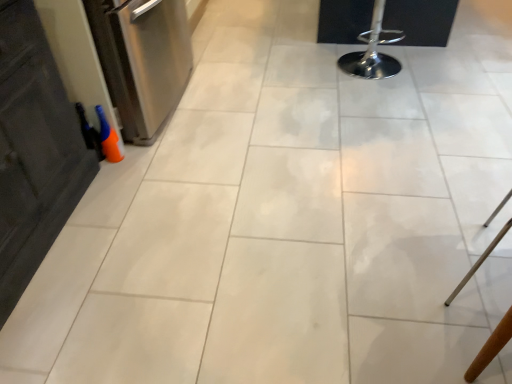
Question: From the image's perspective, would you say polished chrome bar stool at upper right is shown under wooden chair at lower right?

Choices:
 (A) yes
 (B) no

Answer: (B)

Question: Is polished chrome bar stool at upper right not inside wooden chair at lower right?

Choices:
 (A) yes
 (B) no

Answer: (A)

Question: Considering the relative sizes of polished chrome bar stool at upper right and wooden chair at lower right in the image provided, is polished chrome bar stool at upper right taller than wooden chair at lower right?

Choices:
 (A) no
 (B) yes

Answer: (A)

Question: Is polished chrome bar stool at upper right surrounding wooden chair at lower right?

Choices:
 (A) no
 (B) yes

Answer: (A)

Question: Considering the relative sizes of polished chrome bar stool at upper right and wooden chair at lower right in the image provided, is polished chrome bar stool at upper right thinner than wooden chair at lower right?

Choices:
 (A) no
 (B) yes

Answer: (A)

Question: Are polished chrome bar stool at upper right and wooden chair at lower right located far from each other?

Choices:
 (A) no
 (B) yes

Answer: (B)

Question: Does polished chrome bar stool at upper right turn towards stainless steel dishwasher at left?

Choices:
 (A) no
 (B) yes

Answer: (A)

Question: From a real-world perspective, is polished chrome bar stool at upper right over stainless steel dishwasher at left?

Choices:
 (A) yes
 (B) no

Answer: (B)

Question: Does polished chrome bar stool at upper right have a larger size compared to stainless steel dishwasher at left?

Choices:
 (A) no
 (B) yes

Answer: (A)

Question: From a real-world perspective, is polished chrome bar stool at upper right below stainless steel dishwasher at left?

Choices:
 (A) no
 (B) yes

Answer: (B)

Question: Does polished chrome bar stool at upper right appear on the right side of stainless steel dishwasher at left?

Choices:
 (A) yes
 (B) no

Answer: (A)

Question: Does polished chrome bar stool at upper right appear on the left side of stainless steel dishwasher at left?

Choices:
 (A) no
 (B) yes

Answer: (A)

Question: Would you say stainless steel dishwasher at left is outside wooden chair at lower right?

Choices:
 (A) yes
 (B) no

Answer: (A)